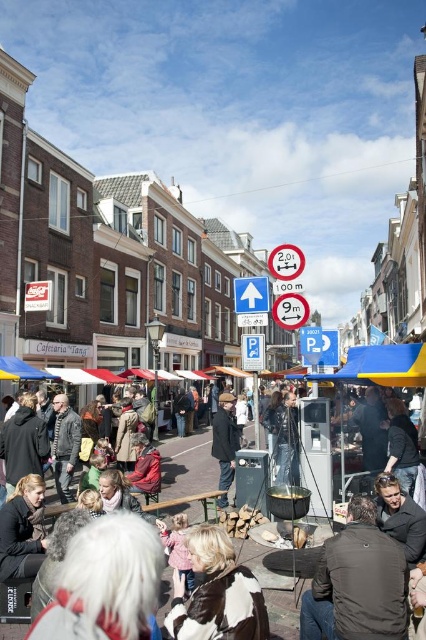
Question: Which of the following is the farthest from the observer?

Choices:
 (A) dark brown leather jacket at lower center
 (B) yellow fabric canopy at center
 (C) black-and-white fur coat at center
 (D) blue fabric canopy at lower left

Answer: (D)

Question: Which point is farther to the camera?

Choices:
 (A) (236, 609)
 (B) (354, 362)

Answer: (B)

Question: Which of these objects is positioned farthest from the yellow fabric canopy at center?

Choices:
 (A) dark gray jacket at center
 (B) dark brown leather jacket at lower center
 (C) blue fabric canopy at lower left
 (D) black-and-white fur coat at center

Answer: (C)

Question: Is yellow fabric canopy at center thinner than blue fabric canopy at lower left?

Choices:
 (A) yes
 (B) no

Answer: (B)

Question: Is the position of dark brown leather jacket at lower center less distant than that of blue fabric canopy at lower left?

Choices:
 (A) yes
 (B) no

Answer: (A)

Question: Does black-and-white fur coat at center appear over blue fabric canopy at lower left?

Choices:
 (A) no
 (B) yes

Answer: (A)